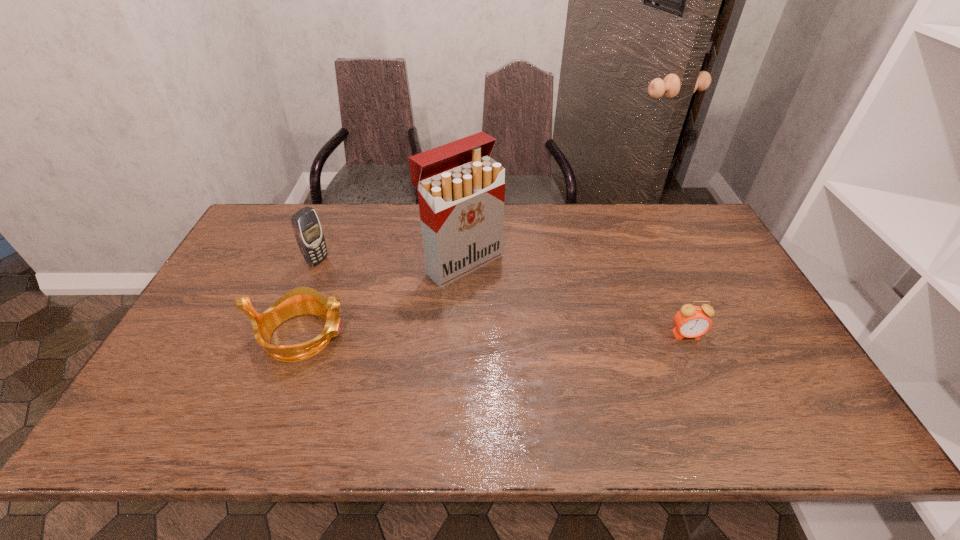
At what (x,y) coordinates should I click in order to perform the action: click on vacant space at the far right corner. Please return your answer as a coordinate pair (x, y). The height and width of the screenshot is (540, 960). Looking at the image, I should click on (702, 219).

At what (x,y) coordinates should I click in order to perform the action: click on vacant area that lies between the tiara and the cigarette case. Please return your answer as a coordinate pair (x, y). Looking at the image, I should click on (382, 299).

Locate an element on the screen. The width and height of the screenshot is (960, 540). free spot between the cigarette case and the cellular telephone is located at coordinates (390, 262).

Where is `free space that is in between the tiara and the cigarette case`? This screenshot has width=960, height=540. free space that is in between the tiara and the cigarette case is located at coordinates (382, 299).

In order to click on free area in between the rightmost object and the cigarette case in this screenshot , I will do pyautogui.click(x=575, y=299).

This screenshot has width=960, height=540. Find the location of `vacant point located between the tiara and the rightmost object`. vacant point located between the tiara and the rightmost object is located at coordinates (494, 335).

Where is `free space between the tallest object and the tiara`? This screenshot has height=540, width=960. free space between the tallest object and the tiara is located at coordinates (382, 299).

Locate an element on the screen. vacant area that lies between the third object from left to right and the tiara is located at coordinates (382, 299).

Where is `free area in between the tiara and the rightmost object`? This screenshot has height=540, width=960. free area in between the tiara and the rightmost object is located at coordinates (494, 335).

At what (x,y) coordinates should I click in order to perform the action: click on vacant space in between the third shortest object and the rightmost object. Please return your answer as a coordinate pair (x, y). The width and height of the screenshot is (960, 540). Looking at the image, I should click on (502, 298).